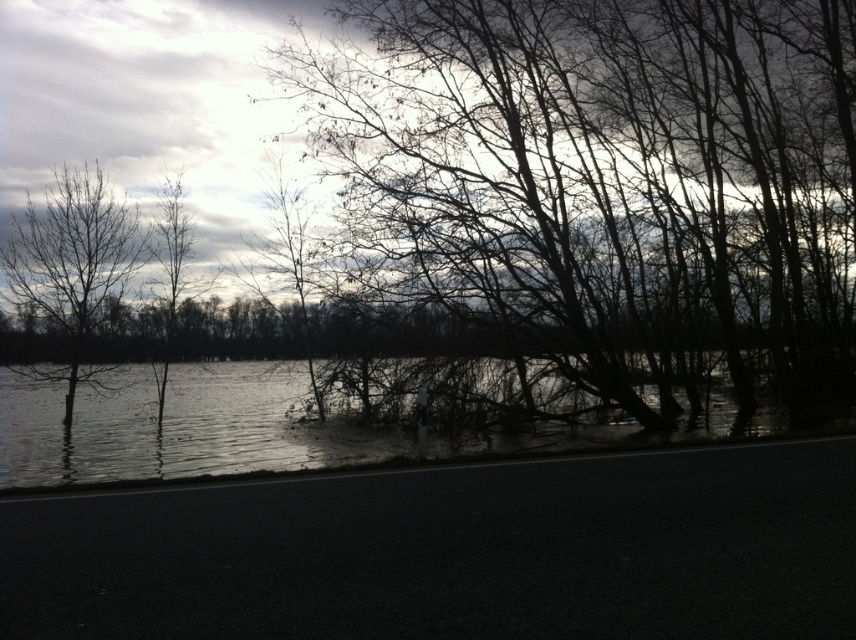
You are a bird looking for a higher perch. You see the bare branches at left and the silvery bark tree at upper left. Which one should you choose to get a better view?

The bare branches at left is much taller than the silvery bark tree at upper left, so you should choose the bare branches at left to get a better view.

You are driving a car that is 4 meters long. You see the dark reflective water at lower left and the silvery bark tree at upper left. Can your car fit entirely between them without touching either?

The dark reflective water at lower left is 7.77 meters away from the silvery bark tree at upper left. Since your car is 4 meters long, it can fit between them as the distance is greater than the car length.

You are a bird looking for a place to perch. You see the bare branches at left and the silvery bark tree at upper left. Which one is higher up in the sky for you to land on?

The bare branches at left is located above the silvery bark tree at upper left, so it is higher up in the sky for the bird to land on.